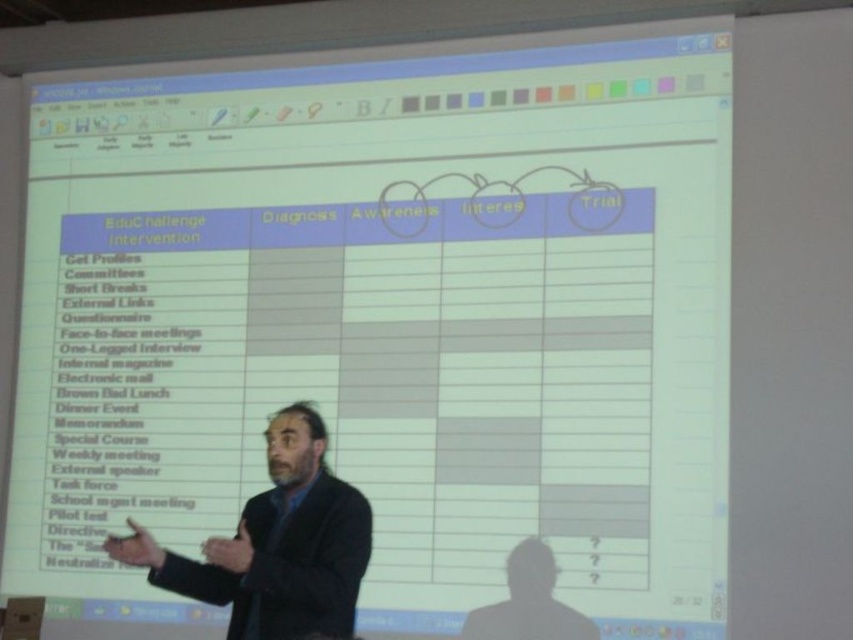
In the scene shown: You are organizing a formal event and need to choose between two suits for your presentation. You have a black suit at center and a dark suit at center. Which one would you recommend based on their sizes?

The black suit at center is larger in size compared to the dark suit at center, so it would be more suitable for a formal event if you prefer a more prominent look.

You are a security guard in the conference room. You notice two men wearing black suit at center and dark suit at center. You need to check their IDs. Which one is closer to you?

The black suit at center is closer to you since it is 36.13 inches away from the dark suit at center.